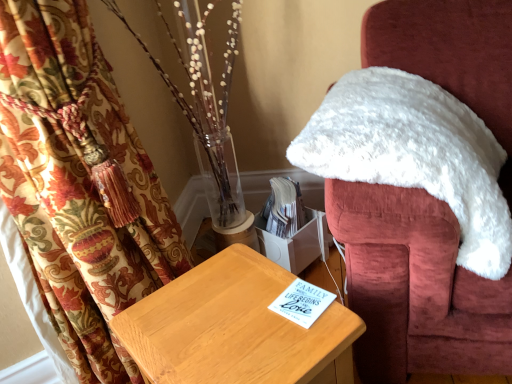
Locate an element on the screen. light brown wooden table at center is located at coordinates (234, 328).

What do you see at coordinates (234, 328) in the screenshot? I see `light brown wooden table at center` at bounding box center [234, 328].

Identify the location of white fluffy chair at upper right. The height and width of the screenshot is (384, 512). (416, 287).

The width and height of the screenshot is (512, 384). Describe the element at coordinates (416, 287) in the screenshot. I see `white fluffy chair at upper right` at that location.

Looking at this image, what is the approximate width of white fluffy chair at upper right?

The width of white fluffy chair at upper right is 51.06 centimeters.

You are a GUI agent. You are given a task and a screenshot of the screen. Output one action in this format:
    pyautogui.click(x=<x>, y=<y>)
    Task: Click on the light brown wooden table at center
    The width and height of the screenshot is (512, 384).
    Given the screenshot: What is the action you would take?
    pyautogui.click(x=234, y=328)

Between white fluffy chair at upper right and light brown wooden table at center, which one appears on the left side from the viewer's perspective?

Positioned to the left is light brown wooden table at center.

Considering the relative positions of white fluffy chair at upper right and light brown wooden table at center in the image provided, is white fluffy chair at upper right behind light brown wooden table at center?

That is True.

Which is closer, [364,57] or [234,373]?

Point [364,57] appears to be farther away from the viewer than point [234,373].

Based on the photo, from the image's perspective, is white fluffy chair at upper right on top of light brown wooden table at center?

Yes, from the image's perspective, white fluffy chair at upper right is above light brown wooden table at center.

From a real-world perspective, who is located higher, white fluffy chair at upper right or light brown wooden table at center?

white fluffy chair at upper right.

Considering the sizes of white fluffy chair at upper right and light brown wooden table at center in the image, is white fluffy chair at upper right wider or thinner than light brown wooden table at center?

white fluffy chair at upper right is wider than light brown wooden table at center.

Between white fluffy chair at upper right and light brown wooden table at center, which one has more height?

With more height is white fluffy chair at upper right.

Which of these two, white fluffy chair at upper right or light brown wooden table at center, is smaller?

With smaller size is light brown wooden table at center.

Is white fluffy chair at upper right completely or partially outside of light brown wooden table at center?

Yes, white fluffy chair at upper right is located beyond the bounds of light brown wooden table at center.

Would you say white fluffy chair at upper right is a long distance from light brown wooden table at center?

No, white fluffy chair at upper right is not far from light brown wooden table at center.

Is white fluffy chair at upper right looking in the opposite direction of light brown wooden table at center?

white fluffy chair at upper right is not turned away from light brown wooden table at center.

How different are the orientations of white fluffy chair at upper right and light brown wooden table at center in degrees?

They differ by 29.4 degrees in their facing directions.

Measure the distance from white fluffy chair at upper right to light brown wooden table at center.

The distance of white fluffy chair at upper right from light brown wooden table at center is 30.97 centimeters.

Locate an element on the screen. chair positioned vertically above the light brown wooden table at center (from a real-world perspective) is located at coordinates (416, 287).

In the image, is light brown wooden table at center on the left side or the right side of white fluffy chair at upper right?

Clearly, light brown wooden table at center is on the left of white fluffy chair at upper right in the image.

Which object is closer to the camera, light brown wooden table at center or white fluffy chair at upper right?

light brown wooden table at center is in front.

Does point (334, 325) appear closer or farther from the camera than point (386, 220)?

Point (334, 325) is positioned closer to the camera compared to point (386, 220).

From the image's perspective, is light brown wooden table at center beneath white fluffy chair at upper right?

Correct, light brown wooden table at center appears lower than white fluffy chair at upper right in the image.

From a real-world perspective, is light brown wooden table at center positioned over white fluffy chair at upper right based on gravity?

No.

Which object is wider, light brown wooden table at center or white fluffy chair at upper right?

Wider between the two is white fluffy chair at upper right.

Between light brown wooden table at center and white fluffy chair at upper right, which one has less height?

light brown wooden table at center is shorter.

Looking at the image, does light brown wooden table at center seem bigger or smaller compared to white fluffy chair at upper right?

light brown wooden table at center is smaller than white fluffy chair at upper right.

Is light brown wooden table at center inside the boundaries of white fluffy chair at upper right, or outside?

light brown wooden table at center exists outside the volume of white fluffy chair at upper right.

Can you see light brown wooden table at center touching white fluffy chair at upper right?

No, light brown wooden table at center is not next to white fluffy chair at upper right.

Is light brown wooden table at center turned away from white fluffy chair at upper right?

light brown wooden table at center does not have its back to white fluffy chair at upper right.

What's the angular difference between light brown wooden table at center and white fluffy chair at upper right's facing directions?

The angle between the facing direction of light brown wooden table at center and the facing direction of white fluffy chair at upper right is 29.4 degrees.

Measure the distance from light brown wooden table at center to white fluffy chair at upper right.

The distance of light brown wooden table at center from white fluffy chair at upper right is 30.97 centimeters.

Where is `furniture that appears on the left of white fluffy chair at upper right`? The width and height of the screenshot is (512, 384). furniture that appears on the left of white fluffy chair at upper right is located at coordinates pos(234,328).

Identify the location of chair lying on the right of light brown wooden table at center. The width and height of the screenshot is (512, 384). 416,287.

The height and width of the screenshot is (384, 512). Find the location of `chair behind the light brown wooden table at center`. chair behind the light brown wooden table at center is located at coordinates click(416, 287).